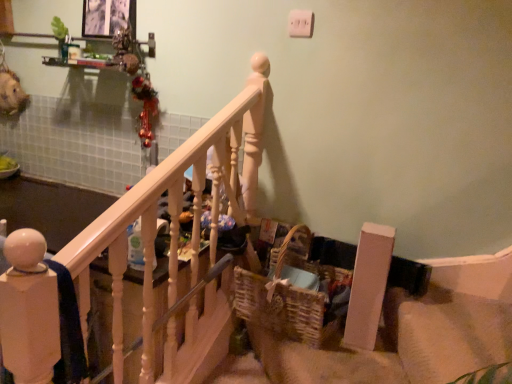
Question: Relative to white painted wood railing at upper left, is woven brown basket at lower center in front or behind?

Choices:
 (A) front
 (B) behind

Answer: (B)

Question: Considering the positions of point (241, 289) and point (216, 288), is point (241, 289) closer or farther from the camera than point (216, 288)?

Choices:
 (A) farther
 (B) closer

Answer: (B)

Question: Considering the positions of woven brown basket at lower center and white painted wood railing at upper left in the image, is woven brown basket at lower center taller or shorter than white painted wood railing at upper left?

Choices:
 (A) tall
 (B) short

Answer: (B)

Question: Does point (249, 145) appear closer or farther from the camera than point (287, 299)?

Choices:
 (A) closer
 (B) farther

Answer: (B)

Question: Looking at the image, does white painted wood railing at upper left seem bigger or smaller compared to woven brown basket at lower center?

Choices:
 (A) big
 (B) small

Answer: (A)

Question: Would you say white painted wood railing at upper left is to the left or to the right of woven brown basket at lower center in the picture?

Choices:
 (A) left
 (B) right

Answer: (A)

Question: From their relative heights in the image, would you say white painted wood railing at upper left is taller or shorter than woven brown basket at lower center?

Choices:
 (A) tall
 (B) short

Answer: (A)